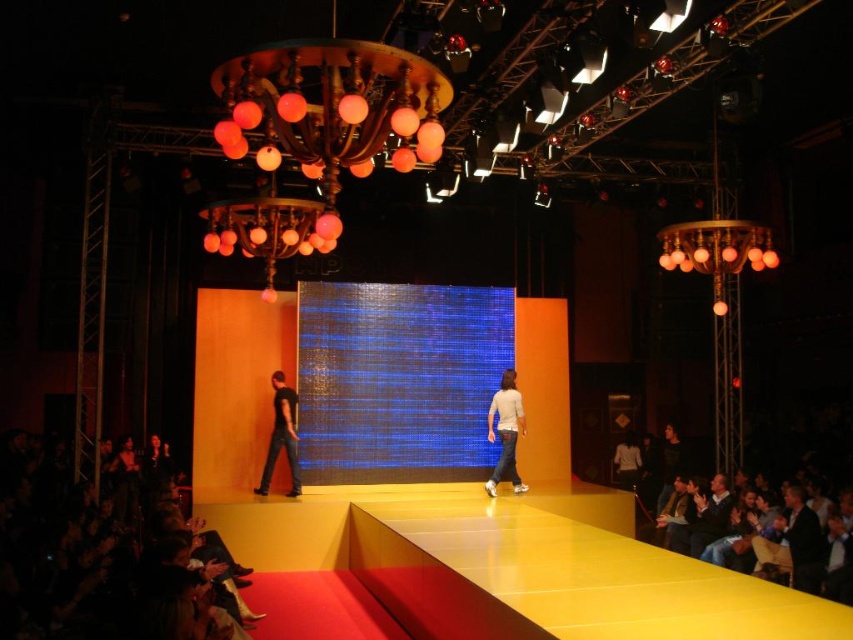
From the picture: Can you confirm if matte orange glass chandelier at upper right is taller than dark blue shirt at lower right?

Indeed, matte orange glass chandelier at upper right has a greater height compared to dark blue shirt at lower right.

Which is below, matte orange glass chandelier at upper right or dark blue shirt at lower right?

dark blue shirt at lower right is lower down.

Is point (670, 241) positioned after point (717, 492)?

No.

I want to click on matte orange glass chandelier at upper right, so click(x=717, y=250).

Does matte gold chandelier at upper center appear on the left side of dark blue shirt at lower right?

Indeed, matte gold chandelier at upper center is positioned on the left side of dark blue shirt at lower right.

In the scene shown: Is matte gold chandelier at upper center further to the viewer compared to dark blue shirt at lower right?

No, matte gold chandelier at upper center is closer to the viewer.

Between point (305, 109) and point (712, 474), which one is positioned in front?

Positioned in front is point (305, 109).

Image resolution: width=853 pixels, height=640 pixels. I want to click on matte gold chandelier at upper center, so click(318, 132).

Can you confirm if white matte sweater at center is positioned below dark blue shirt at lower right?

No, white matte sweater at center is not below dark blue shirt at lower right.

Does white matte sweater at center have a greater width compared to dark blue shirt at lower right?

In fact, white matte sweater at center might be narrower than dark blue shirt at lower right.

This screenshot has height=640, width=853. I want to click on white matte sweater at center, so click(505, 433).

Where is `white matte sweater at center`? This screenshot has height=640, width=853. white matte sweater at center is located at coordinates (x=505, y=433).